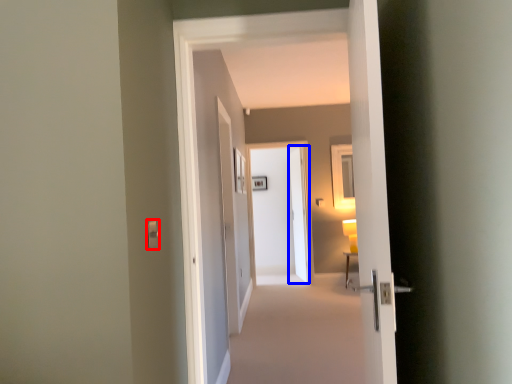
Question: Which of the following is the farthest to the observer, light switch (highlighted by a red box) or screen door (highlighted by a blue box)?

Choices:
 (A) light switch
 (B) screen door

Answer: (B)